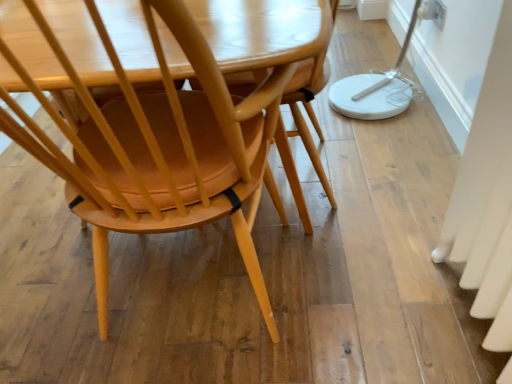
The height and width of the screenshot is (384, 512). In order to click on vacant space underneath matte wood chair at center (from a real-world perspective) in this screenshot , I will do `click(198, 306)`.